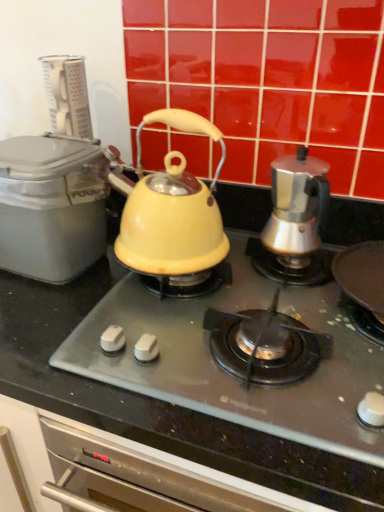
Question: From a real-world perspective, is matte gray container at left above or below matte yellow kettle at center?

Choices:
 (A) below
 (B) above

Answer: (B)

Question: In terms of size, does matte gray container at left appear bigger or smaller than matte yellow kettle at center?

Choices:
 (A) big
 (B) small

Answer: (B)

Question: Which is nearer to the matte yellow kettle at center?

Choices:
 (A) satin silver coffee maker at right, which is the 2th kettle from left to right
 (B) matte yellow kettle at center, acting as the first kettle starting from the left
 (C) matte gray container at left

Answer: (B)

Question: Which object is the farthest from the satin silver coffee maker at right, which is the 2th kettle from left to right?

Choices:
 (A) matte gray container at left
 (B) matte yellow kettle at center
 (C) matte yellow kettle at center, acting as the first kettle starting from the left

Answer: (A)